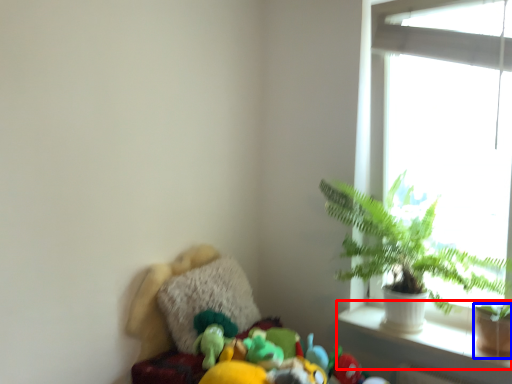
Question: Which object is further to the camera taking this photo, window sill (highlighted by a red box) or flowerpot (highlighted by a blue box)?

Choices:
 (A) window sill
 (B) flowerpot

Answer: (B)